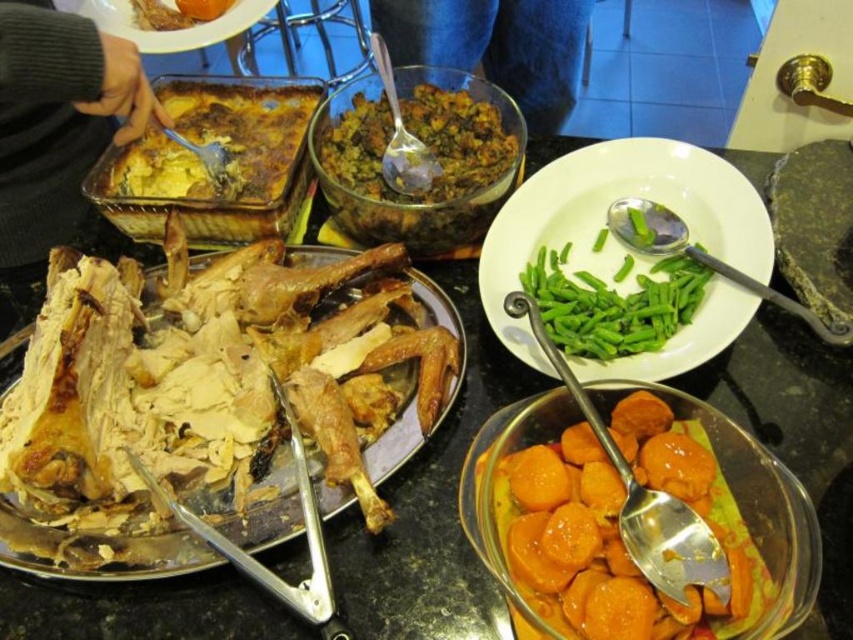
Based on the photo, you are a guest at the holiday feast and want to choose the larger portion between the golden brown crispy chicken at center and the orange glazed sweet potato at center. Which one should you pick?

The golden brown crispy chicken at center has a larger size compared to the orange glazed sweet potato at center, so you should pick the golden brown crispy chicken at center for a larger portion.

You are a guest sitting at the table and want to reach both the roasted turkey and the string beans. The roasted turkey is located at point (700, 276) and the string beans are at point (244, 26). Which dish is closer to you?

Point (700, 276) is in front of point (244, 26), so the roasted turkey at point (700, 276) is closer to you.